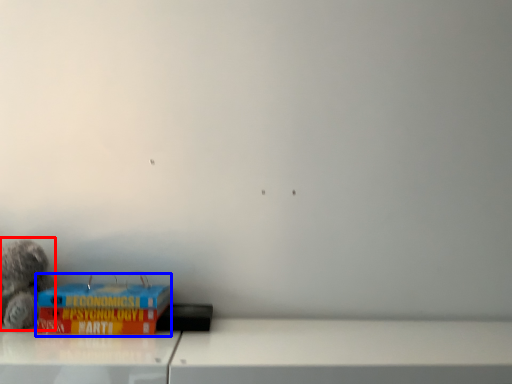
Question: Which object appears closest to the camera in this image, toy (highlighted by a red box) or paperback book (highlighted by a blue box)?

Choices:
 (A) toy
 (B) paperback book

Answer: (B)